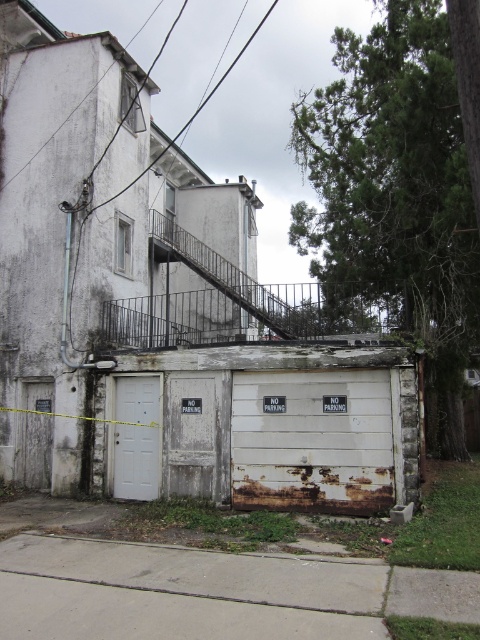
Can you confirm if rusty wood garage door at center is wider than white matte door at lower left?

Yes.

Does rusty wood garage door at center have a lesser height compared to white matte door at lower left?

No.

This screenshot has width=480, height=640. Find the location of `rusty wood garage door at center`. rusty wood garage door at center is located at coordinates (313, 440).

Between gray concrete sidewalk at lower center and rusty wood garage door at center, which one appears on the right side from the viewer's perspective?

Positioned to the right is rusty wood garage door at center.

Does gray concrete sidewalk at lower center come in front of rusty wood garage door at center?

Yes, it is.

Image resolution: width=480 pixels, height=640 pixels. I want to click on gray concrete sidewalk at lower center, so click(180, 593).

Is rusty white garage door at lower center further to camera compared to white matte door at lower left?

No.

Which of these two, rusty white garage door at lower center or white matte door at lower left, stands taller?

rusty white garage door at lower center

Is point (172, 433) closer to camera compared to point (133, 401)?

Yes.

The image size is (480, 640). Identify the location of rusty white garage door at lower center. (264, 426).